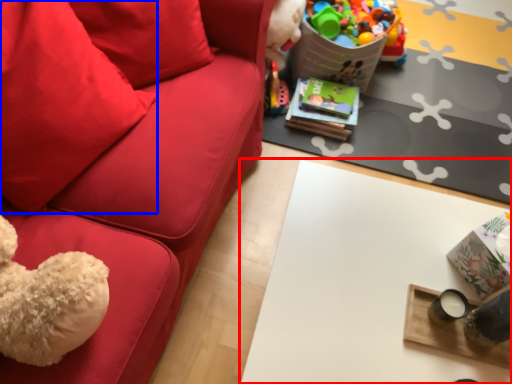
Question: Which object is closer to the camera taking this photo, table (highlighted by a red box) or pillow (highlighted by a blue box)?

Choices:
 (A) table
 (B) pillow

Answer: (B)